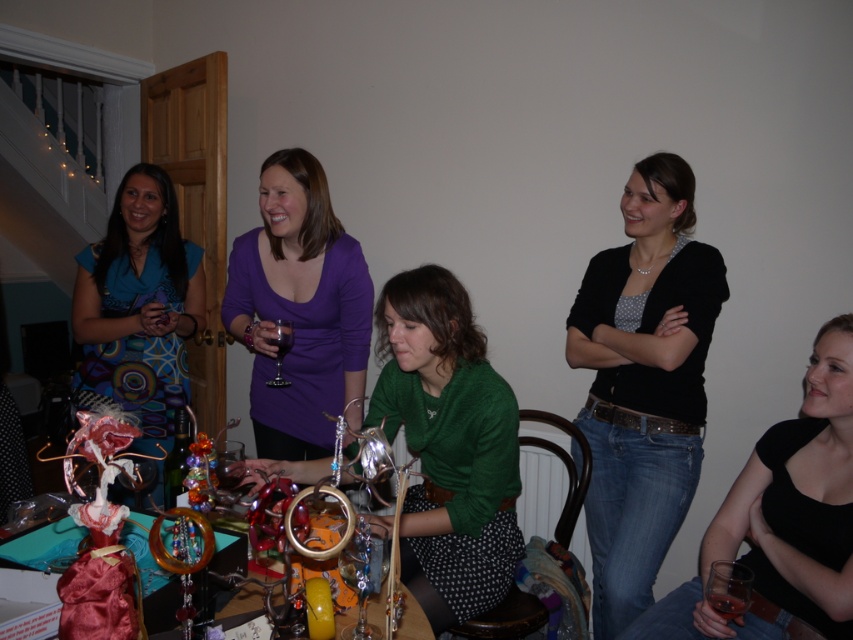
Looking at this image, you are a guest at this gathering and want to place a small decorative item between the green matte sweater at center and the transparent glass wine glass at center. Which object should you place it closer to to avoid knocking over the wine glass?

You should place the decorative item closer to the green matte sweater at center because it is larger and less likely to be knocked over compared to the transparent glass wine glass at center.

From the picture: You are a photographer trying to capture a candid shot of the black matte cardigan at center and the green matte sweater at center. Your camera has a maximum focus range of 18 inches. Can you photograph both items clearly in the same frame without moving either?

The black matte cardigan at center is 18.80 inches away from the green matte sweater at center. Since the distance exceeds the camera maximum focus range of 18 inches, you cannot photograph both items clearly in the same frame without moving them.

You are a delivery robot with a 1.2 meter arm. You need to place a package on the table where the transparent glass wine glass at center is located. Can your arm reach the table from your current position?

The distance between the transparent glass wine glass at center and the camera is 1.28 meters. Since the robot arm is 1.2 meters, it may not be able to reach the table where the glass is placed as the distance is slightly longer than the arm length.